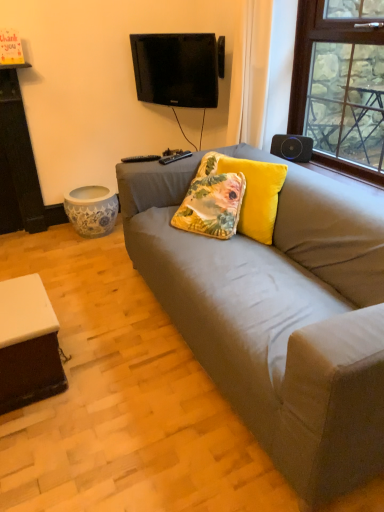
Measure the distance between point (58, 360) and camera.

Point (58, 360) is 1.76 meters from camera.

You are a GUI agent. You are given a task and a screenshot of the screen. Output one action in this format:
    pyautogui.click(x=<x>, y=<y>)
    Task: Click on the black glossy tv at upper center
    
    Given the screenshot: What is the action you would take?
    pyautogui.click(x=177, y=68)

Describe the element at coordinates (292, 147) in the screenshot. I see `black matte speaker at upper right` at that location.

The image size is (384, 512). I want to click on black matte speaker at upper right, so click(x=292, y=147).

Where is `white matte table at lower left`? white matte table at lower left is located at coordinates (28, 344).

Is black matte speaker at upper right beside matte gray couch at center?

No, black matte speaker at upper right is not making contact with matte gray couch at center.

Which object is positioned more to the left, black matte speaker at upper right or matte gray couch at center?

From the viewer's perspective, matte gray couch at center appears more on the left side.

Is black matte speaker at upper right positioned before matte gray couch at center?

No, black matte speaker at upper right is further to the viewer.

In terms of size, does matte gray couch at center appear bigger or smaller than velvet yellow pillow at center, the 1th pillow from the right?

Considering their sizes, matte gray couch at center takes up more space than velvet yellow pillow at center, the 1th pillow from the right.

Which is in front, point (338, 193) or point (211, 159)?

The point (338, 193) is closer to the camera.

Which of these two, matte gray couch at center or velvet yellow pillow at center, positioned as the 2th pillow in left-to-right order, stands taller?

Standing taller between the two is matte gray couch at center.

Considering the sizes of objects matte gray couch at center and velvet yellow pillow at center, the 1th pillow from the right, in the image provided, who is wider, matte gray couch at center or velvet yellow pillow at center, the 1th pillow from the right,?

With larger width is matte gray couch at center.

Is point (302, 162) positioned after point (162, 71)?

No, (302, 162) is closer to viewer.

How many degrees apart are the facing directions of black matte speaker at upper right and black glossy tv at upper center?

There is a 19.5-degree angle between the facing directions of black matte speaker at upper right and black glossy tv at upper center.

The width and height of the screenshot is (384, 512). I want to click on loudspeaker on the right of black glossy tv at upper center, so click(x=292, y=147).

Between floral fabric pillow at center, the 1th pillow positioned from the left, and black matte speaker at upper right, which one appears on the left side from the viewer's perspective?

floral fabric pillow at center, the 1th pillow positioned from the left.

Considering the relative sizes of floral fabric pillow at center, positioned as the second pillow in right-to-left order, and black matte speaker at upper right in the image provided, is floral fabric pillow at center, positioned as the second pillow in right-to-left order, shorter than black matte speaker at upper right?

No.

The height and width of the screenshot is (512, 384). Find the location of `loudspeaker to the right of floral fabric pillow at center, the 1th pillow positioned from the left`. loudspeaker to the right of floral fabric pillow at center, the 1th pillow positioned from the left is located at coordinates (292, 147).

Consider the image. Can you confirm if floral fabric pillow at center, the 1th pillow positioned from the left, is wider than black matte speaker at upper right?

Yes, floral fabric pillow at center, the 1th pillow positioned from the left, is wider than black matte speaker at upper right.

Is white matte table at lower left oriented towards floral fabric pillow at center, the 1th pillow positioned from the left?

No, white matte table at lower left is not turned towards floral fabric pillow at center, the 1th pillow positioned from the left.

Find the location of a particular element. The width and height of the screenshot is (384, 512). pillow that is the 1st object to the right of the white matte table at lower left, starting at the anchor is located at coordinates (211, 201).

What's the angular difference between white matte table at lower left and floral fabric pillow at center, positioned as the second pillow in right-to-left order,'s facing directions?

The angle between the facing direction of white matte table at lower left and the facing direction of floral fabric pillow at center, positioned as the second pillow in right-to-left order, is 124 degrees.

Looking at this image, which is nearer, (187, 106) or (273, 137)?

The point (273, 137) is more forward.

Can you confirm if black glossy tv at upper center is wider than black matte speaker at upper right?

Correct, the width of black glossy tv at upper center exceeds that of black matte speaker at upper right.

Between black glossy tv at upper center and black matte speaker at upper right, which one has more height?

Standing taller between the two is black glossy tv at upper center.

In terms of size, does black glossy tv at upper center appear bigger or smaller than black matte speaker at upper right?

Considering their sizes, black glossy tv at upper center takes up more space than black matte speaker at upper right.

Looking at this image, does matte gray couch at center lie behind black matte speaker at upper right?

No, it is in front of black matte speaker at upper right.

Is matte gray couch at center facing away from black matte speaker at upper right?

Correct, matte gray couch at center is looking away from black matte speaker at upper right.

Does matte gray couch at center have a smaller size compared to black matte speaker at upper right?

No.

Identify the location of studio couch below the black matte speaker at upper right (from the image's perspective). (279, 317).

You are a GUI agent. You are given a task and a screenshot of the screen. Output one action in this format:
    pyautogui.click(x=<x>, y=<y>)
    Task: Click on the pillow that is the 1st one when counting leftward from the matte gray couch at center
    The image size is (384, 512).
    Given the screenshot: What is the action you would take?
    pyautogui.click(x=251, y=191)

Based on their spatial positions, is white matte table at lower left or matte gray couch at center further from black matte speaker at upper right?

white matte table at lower left.

Looking at the image, which one is located further to white matte table at lower left, velvet yellow pillow at center, the 1th pillow from the right, or floral fabric pillow at center, the 1th pillow positioned from the left?

Based on the image, velvet yellow pillow at center, the 1th pillow from the right, appears to be further to white matte table at lower left.

Looking at the image, which one is located closer to white matte table at lower left, black matte speaker at upper right or black glossy tv at upper center?

The object closer to white matte table at lower left is black matte speaker at upper right.

Based on the photo, based on their spatial positions, is matte gray couch at center or black matte speaker at upper right further from black glossy tv at upper center?

matte gray couch at center lies further to black glossy tv at upper center than the other object.

From the image, which object appears to be farther from white matte table at lower left, black glossy tv at upper center or matte gray couch at center?

Among the two, black glossy tv at upper center is located further to white matte table at lower left.

Estimate the real-world distances between objects in this image. Which object is closer to black matte speaker at upper right, black glossy tv at upper center or white matte table at lower left?

Among the two, black glossy tv at upper center is located nearer to black matte speaker at upper right.

From the image, which object appears to be nearer to black matte speaker at upper right, floral fabric pillow at center, the 1th pillow positioned from the left, or black glossy tv at upper center?

floral fabric pillow at center, the 1th pillow positioned from the left, is closer to black matte speaker at upper right.

From the image, which object appears to be farther from velvet yellow pillow at center, the 1th pillow from the right, matte gray couch at center or white matte table at lower left?

Among the two, white matte table at lower left is located further to velvet yellow pillow at center, the 1th pillow from the right.

Find the location of a particular element. The height and width of the screenshot is (512, 384). pillow between white matte table at lower left and velvet yellow pillow at center, the 1th pillow from the right is located at coordinates pos(211,201).

The width and height of the screenshot is (384, 512). Find the location of `television located between matte gray couch at center and black matte speaker at upper right in the depth direction`. television located between matte gray couch at center and black matte speaker at upper right in the depth direction is located at coordinates (177, 68).

I want to click on pillow between matte gray couch at center and floral fabric pillow at center, positioned as the second pillow in right-to-left order, along the z-axis, so click(x=251, y=191).

The image size is (384, 512). In order to click on pillow between velvet yellow pillow at center, the 1th pillow from the right, and black matte speaker at upper right in the front-back direction in this screenshot , I will do `click(211, 201)`.